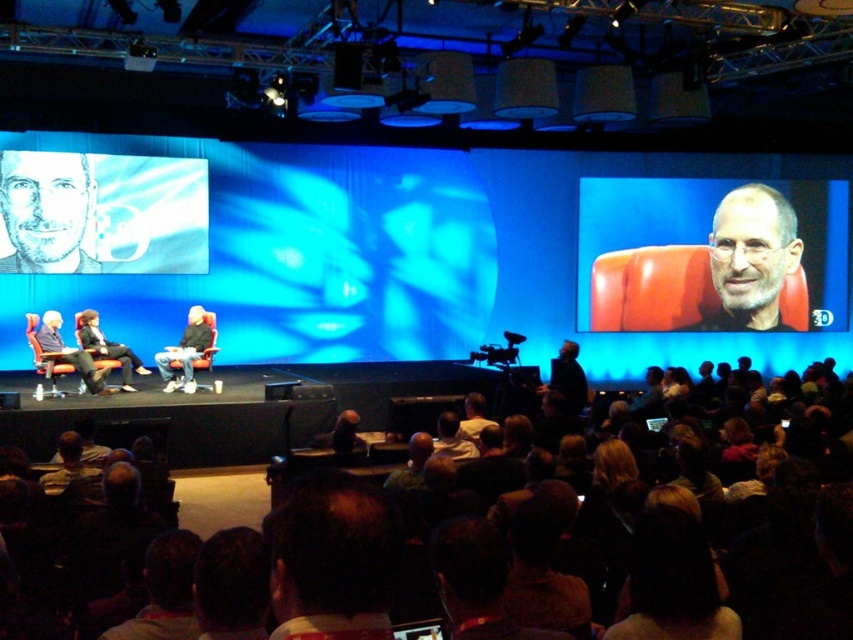
In order to click on gray matte portrait at upper left in this screenshot , I will do `click(45, 211)`.

Locate an element on the screen. Image resolution: width=853 pixels, height=640 pixels. gray matte portrait at upper left is located at coordinates (45, 211).

Does matte black chair at right have a lesser height compared to matte black suit at center?

In fact, matte black chair at right may be taller than matte black suit at center.

Based on the photo, which is above, matte black chair at right or matte black suit at center?

matte black chair at right is above.

Is point (735, 301) farther from viewer compared to point (575, 380)?

Yes, it is behind point (575, 380).

Where is `matte black chair at right`? Image resolution: width=853 pixels, height=640 pixels. matte black chair at right is located at coordinates [x=711, y=256].

Which is more to the right, orange leather chair at left or leather-like orange chair at center?

leather-like orange chair at center

What do you see at coordinates (67, 353) in the screenshot? The image size is (853, 640). I see `orange leather chair at left` at bounding box center [67, 353].

The height and width of the screenshot is (640, 853). Describe the element at coordinates (67, 353) in the screenshot. I see `orange leather chair at left` at that location.

Where is `orange leather chair at left`? The height and width of the screenshot is (640, 853). orange leather chair at left is located at coordinates (67, 353).